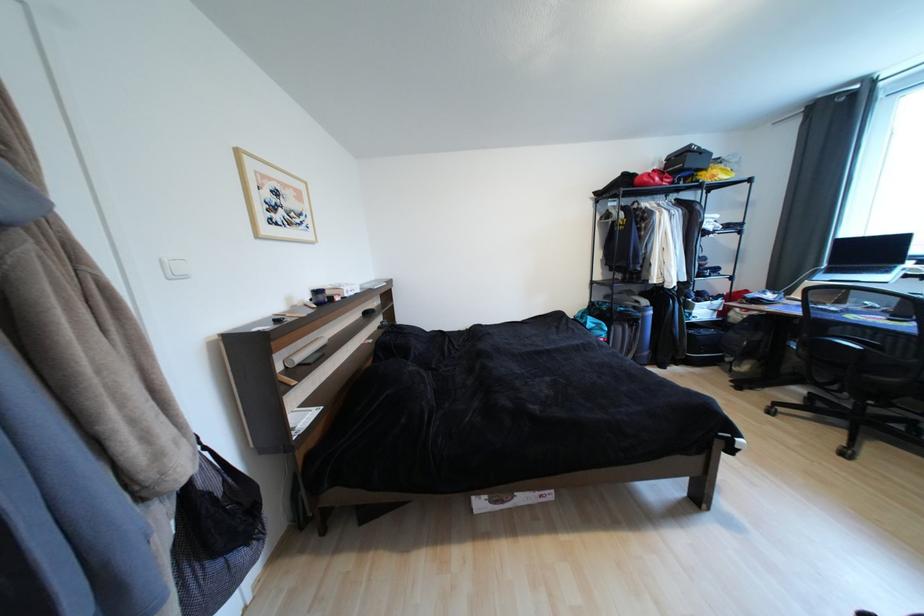
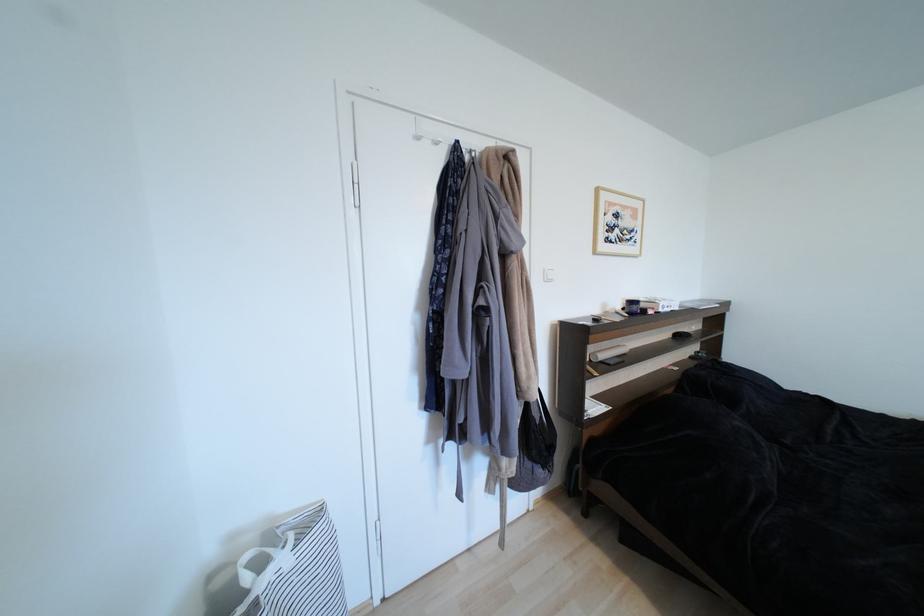
Where in the second image is the point corresponding to [306,366] from the first image?

(608, 363)